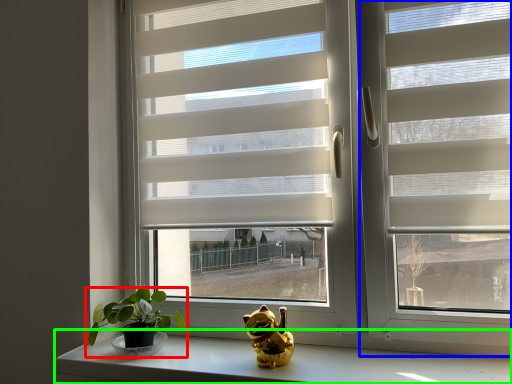
Question: Estimate the real-world distances between objects in this image. Which object is closer to houseplant (highlighted by a red box), screen door (highlighted by a blue box) or counter top (highlighted by a green box)?

Choices:
 (A) screen door
 (B) counter top

Answer: (B)